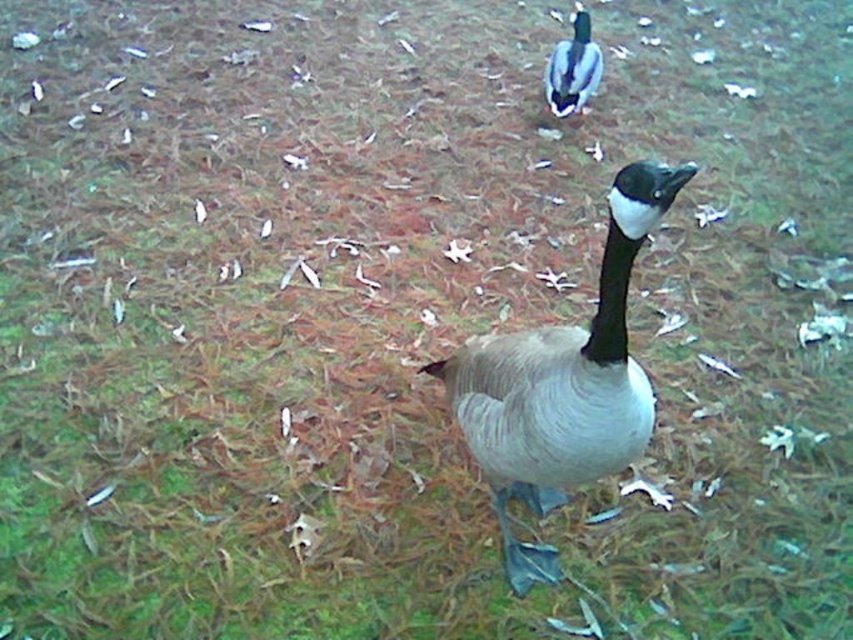
Question: Does gray matte goose at center have a larger size compared to green glossy duck at upper center?

Choices:
 (A) no
 (B) yes

Answer: (B)

Question: Which of the following is the farthest from the observer?

Choices:
 (A) gray matte goose at center
 (B) green glossy duck at upper center

Answer: (B)

Question: Can you confirm if gray matte goose at center is positioned to the left of green glossy duck at upper center?

Choices:
 (A) no
 (B) yes

Answer: (B)

Question: Which object appears closest to the camera in this image?

Choices:
 (A) green glossy duck at upper center
 (B) gray matte goose at center

Answer: (B)

Question: Does gray matte goose at center come behind green glossy duck at upper center?

Choices:
 (A) yes
 (B) no

Answer: (B)